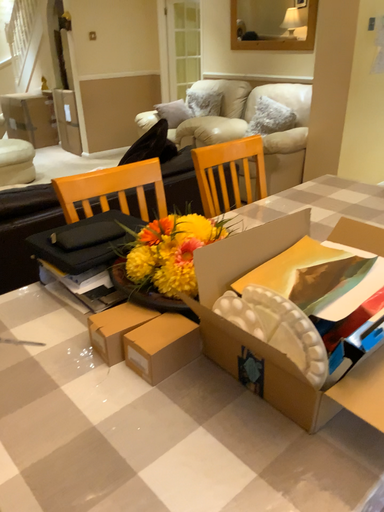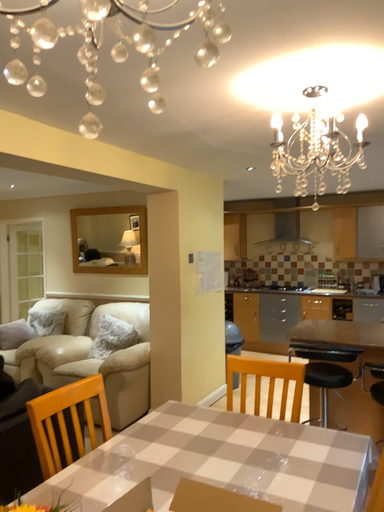
Question: Which way did the camera rotate in the video?

Choices:
 (A) rotated left
 (B) rotated right

Answer: (B)